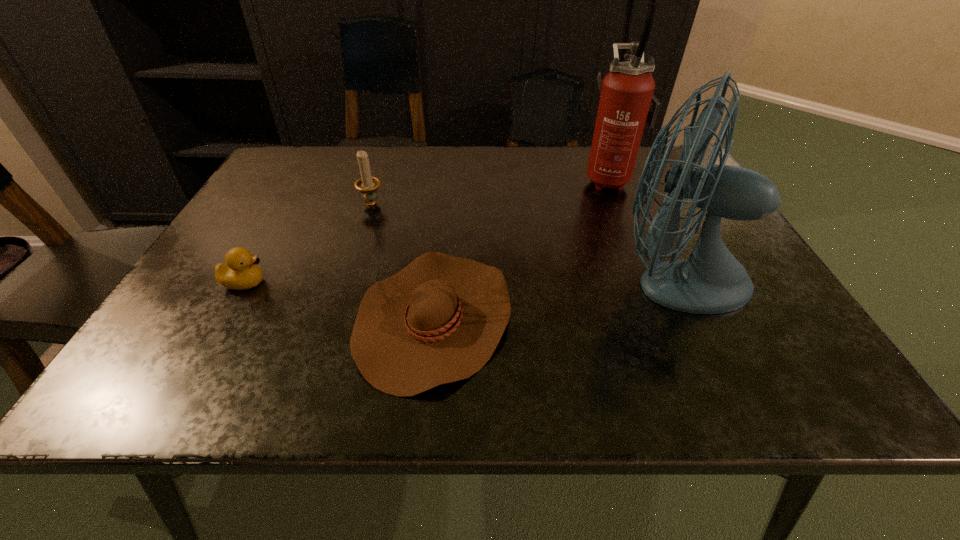
Find the location of a particular element. The image size is (960, 540). free location located at the nozzle of the farthest object is located at coordinates (562, 178).

Identify the location of free space located 0.150m at the nozzle of the farthest object. point(528,178).

Identify the location of free spot located in front of the fourth shortest object to blow air. This screenshot has height=540, width=960. (529, 279).

Image resolution: width=960 pixels, height=540 pixels. Identify the location of vacant space located 0.110m in front of the fourth shortest object to blow air. (548, 279).

You are a GUI agent. You are given a task and a screenshot of the screen. Output one action in this format:
    pyautogui.click(x=<x>, y=<y>)
    Task: Click on the free space located 0.310m in front of the fourth shortest object to blow air
    This screenshot has width=960, height=540.
    Given the screenshot: What is the action you would take?
    pyautogui.click(x=450, y=279)

Locate an element on the screen. Image resolution: width=960 pixels, height=540 pixels. vacant space located 0.300m on the handle side of the fourth object from right to left is located at coordinates (339, 304).

Locate an element on the screen. vacant space situated on the face of the duckling is located at coordinates (328, 282).

I want to click on free space located on the left of the cowboy hat, so (260, 317).

The height and width of the screenshot is (540, 960). In order to click on object located at the far edge in this screenshot , I will do click(627, 101).

You are a GUI agent. You are given a task and a screenshot of the screen. Output one action in this format:
    pyautogui.click(x=<x>, y=<y>)
    Task: Click on the object that is at the near edge
    The width and height of the screenshot is (960, 540).
    Given the screenshot: What is the action you would take?
    pyautogui.click(x=439, y=320)